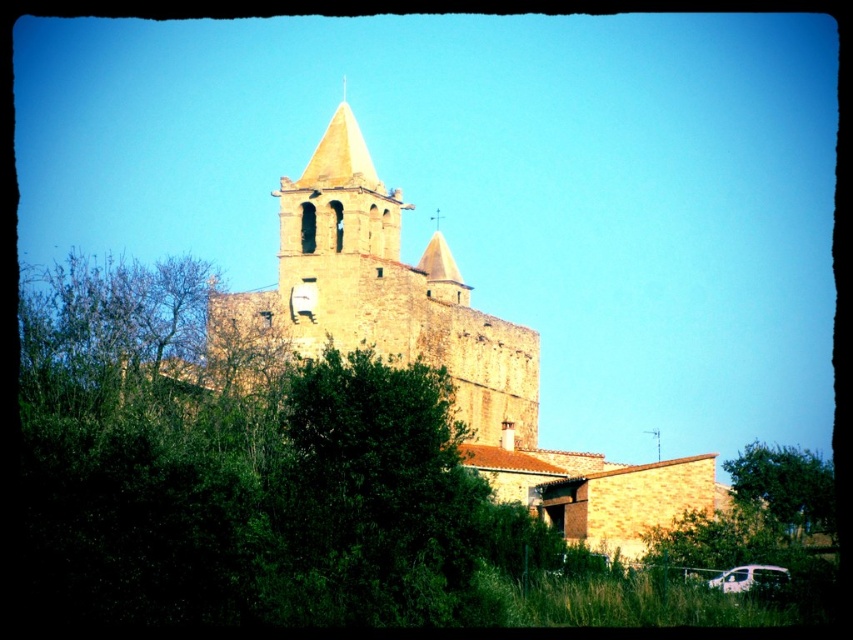
Question: Which is nearer to the stone church at center?

Choices:
 (A) white matte van at lower right
 (B) brown stone church at center
 (C) green leafy tree at lower right

Answer: (B)

Question: Can you confirm if brown stone church at center is smaller than white matte van at lower right?

Choices:
 (A) yes
 (B) no

Answer: (B)

Question: Which of the following is the closest to the observer?

Choices:
 (A) brown stone church at center
 (B) green leafy tree at lower right

Answer: (A)

Question: Does brown stone church at center have a larger size compared to green leafy tree at lower right?

Choices:
 (A) yes
 (B) no

Answer: (A)

Question: Is stone church at center further to camera compared to white matte van at lower right?

Choices:
 (A) no
 (B) yes

Answer: (B)

Question: Which of the following is the closest to the observer?

Choices:
 (A) (622, 554)
 (B) (793, 451)
 (C) (321, 349)
 (D) (718, 582)

Answer: (D)